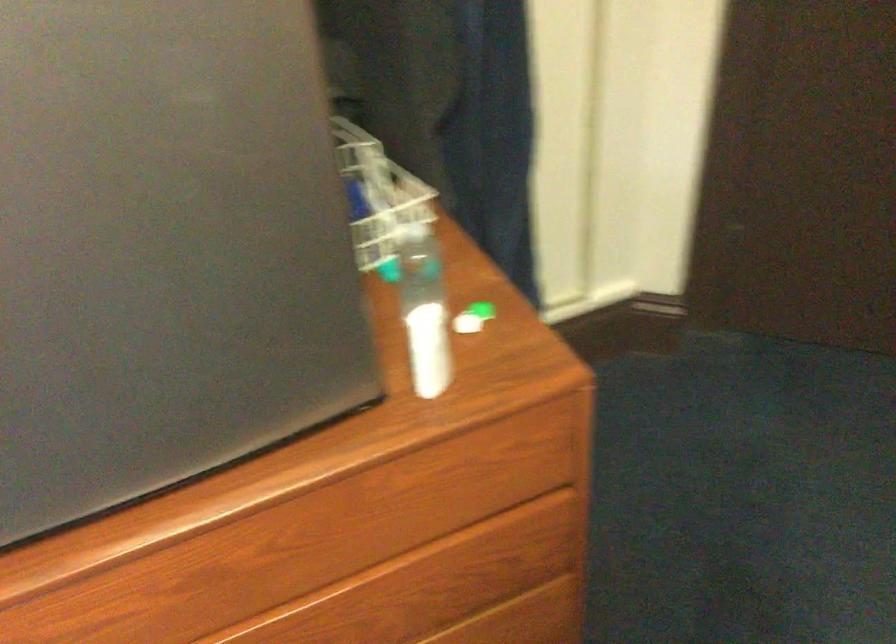
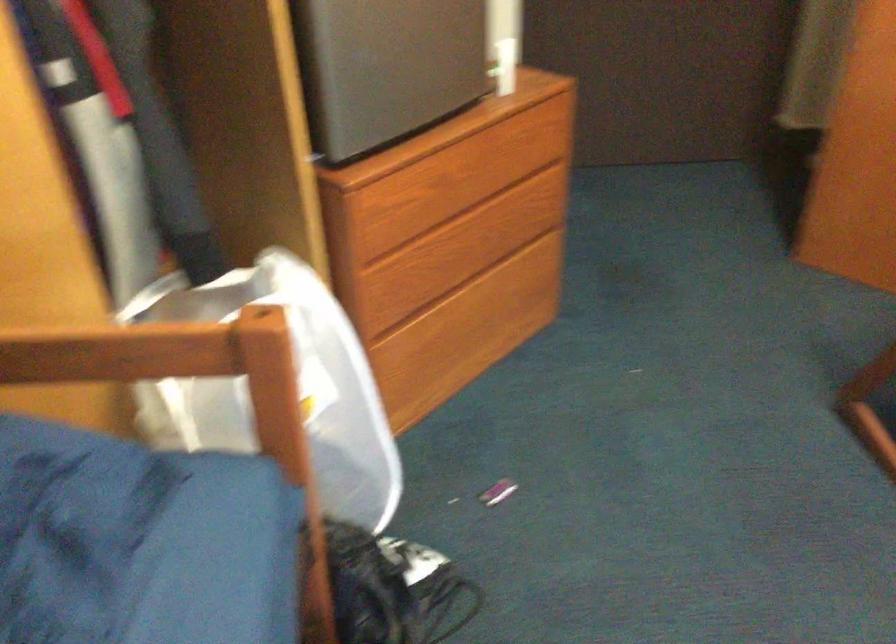
Question: I am providing you with two images of the same scene from different viewpoints. Which of the following objects are not visible in image2?

Choices:
 (A) small purple object
 (B) white plastic bag
 (C) chair sitting surface
 (D) none of these

Answer: (D)